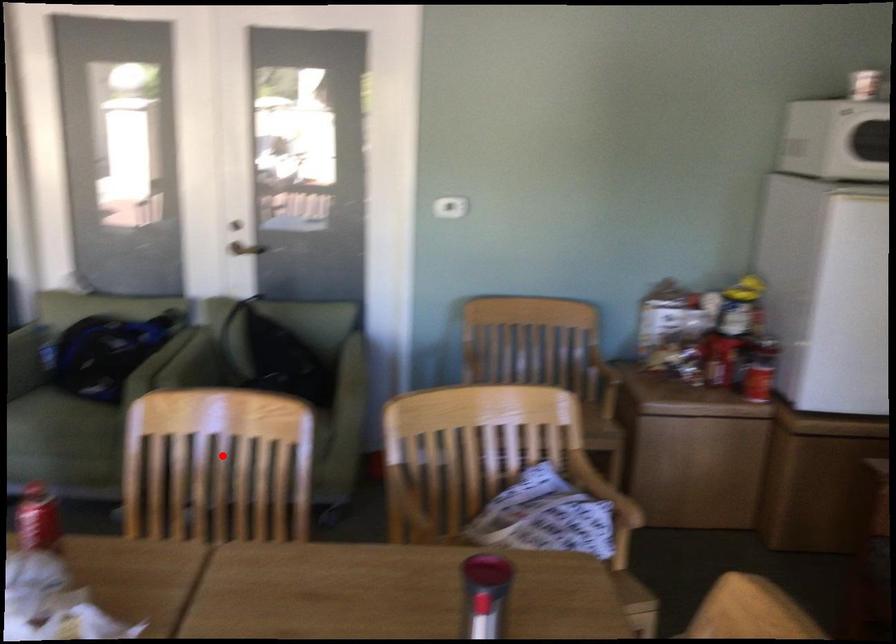
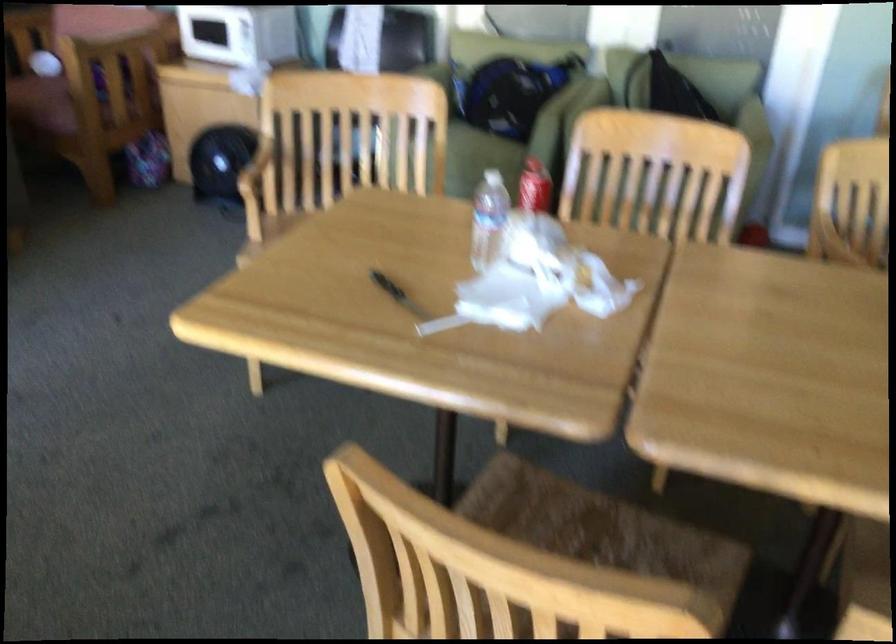
Locate, in the second image, the point that corresponds to the highlighted location in the first image.

(655, 174)